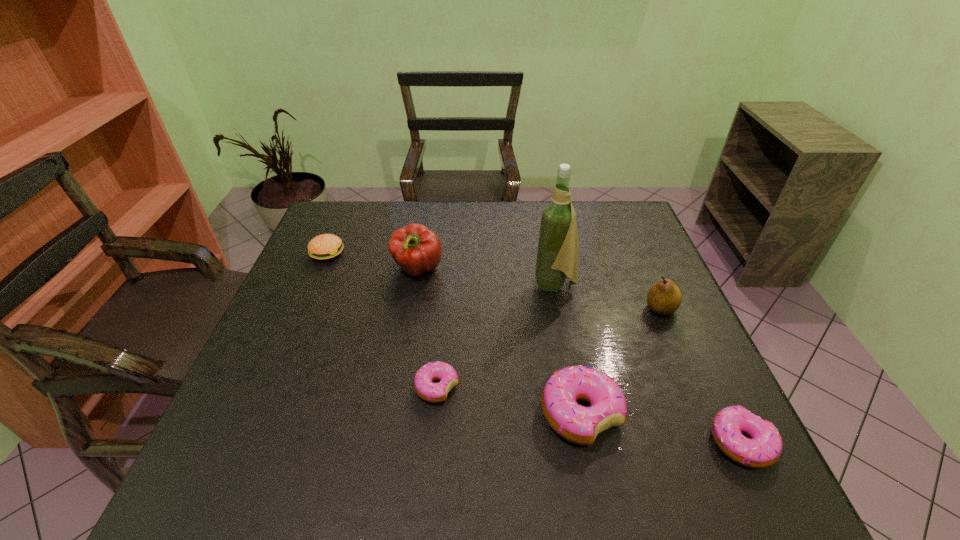
Identify the location of free point that keeps the doughnuts evenly spaced on the left. point(306,363).